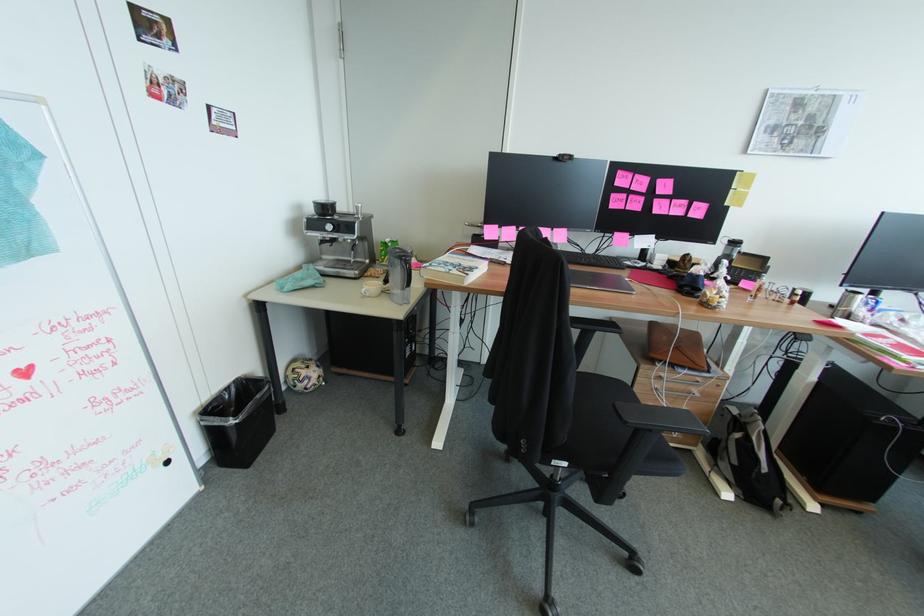
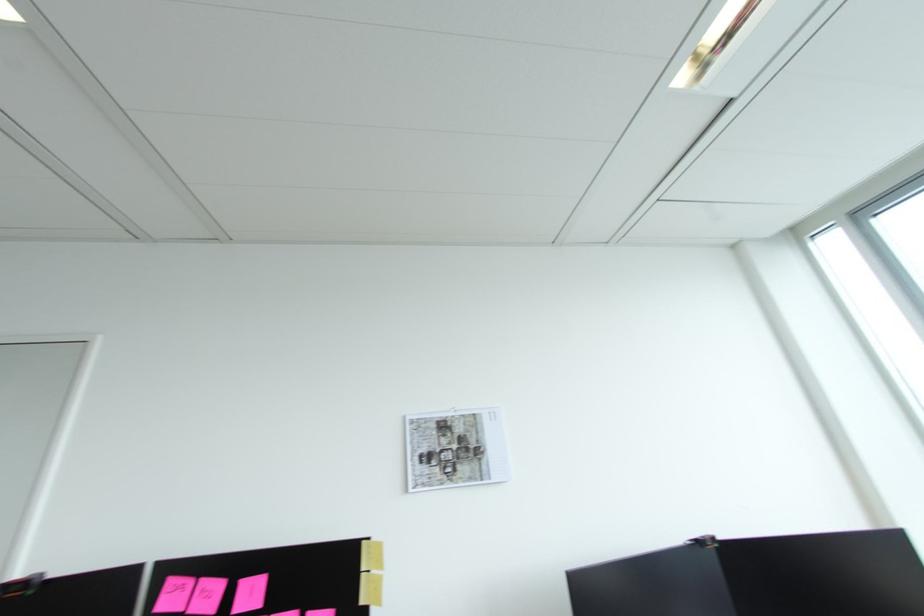
The point at (647, 183) is marked in the first image. Where is the corresponding point in the second image?

(213, 594)